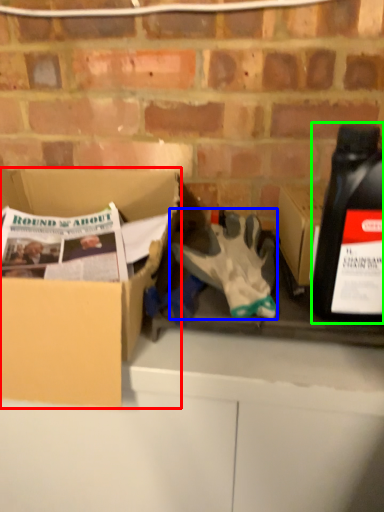
Question: Based on their relative distances, which object is farther from box (highlighted by a red box)? Choose from glove (highlighted by a blue box) and bottle (highlighted by a green box).

Choices:
 (A) glove
 (B) bottle

Answer: (B)